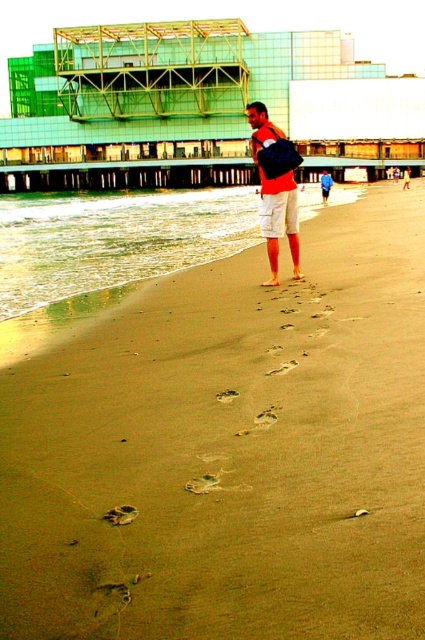
Question: Among these objects, which one is farthest from the camera?

Choices:
 (A) brown sandy beach at center
 (B) matte orange shirt at center
 (C) white cotton shorts at center
 (D) matte orange shorts at center

Answer: (D)

Question: Does matte orange shirt at center have a lesser width compared to white cotton shorts at center?

Choices:
 (A) yes
 (B) no

Answer: (B)

Question: Which point appears farthest from the camera in this image?

Choices:
 (A) [275, 266]
 (B) [328, 193]
 (C) [142, 426]
 (D) [280, 218]

Answer: (B)

Question: Is brown sandy beach at center closer to the viewer compared to white cotton shorts at center?

Choices:
 (A) no
 (B) yes

Answer: (B)

Question: Is brown sandy beach at center positioned behind matte orange shirt at center?

Choices:
 (A) yes
 (B) no

Answer: (B)

Question: Which object appears farthest from the camera in this image?

Choices:
 (A) matte orange shirt at center
 (B) brown sandy beach at center
 (C) matte orange shorts at center

Answer: (C)